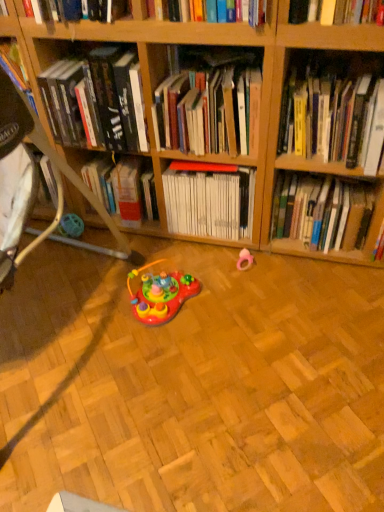
The width and height of the screenshot is (384, 512). What are the coordinates of `vacant space to the left of shiny plastic toy at center, placed as the 2th toy when sorted from right to left` in the screenshot? It's located at (96, 309).